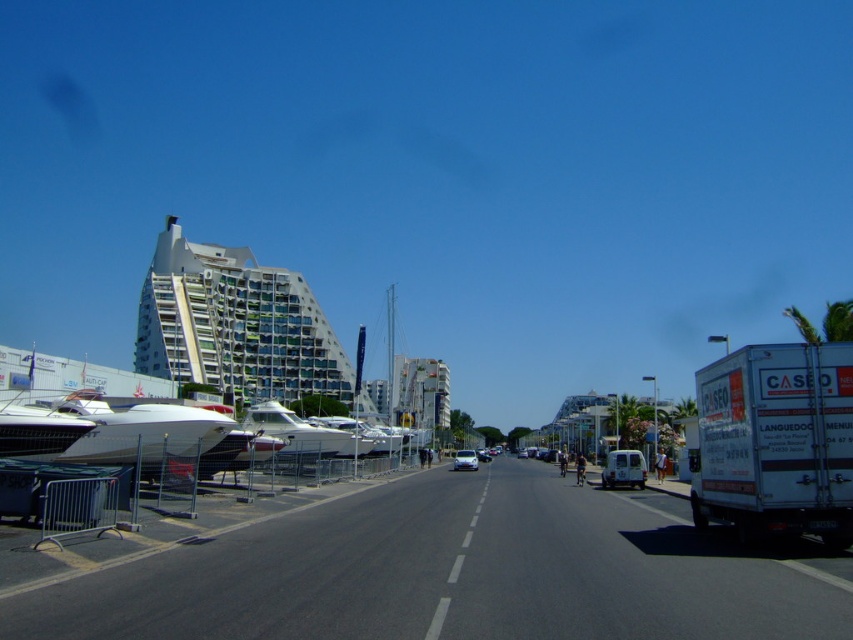
You are a delivery driver who needs to park your truck in the marina area. The marina has a restricted access marked by metal barricades. You see the white glossy boat at center and the silver metallic car at center. Which vehicle has enough space to park next to without overlapping?

The white glossy boat at center is larger in size than the silver metallic car at center, so the silver metallic car at center would require less space to park next to, making it the better option for fitting within the restricted marina area.

You are driving a delivery truck and need to pass through a narrow tunnel that only allows vehicles up to 3 meters in width. You see the white glossy yacht at center and the white glossy car at center in the image. Which vehicle should you avoid taking through the tunnel to ensure safe passage?

The white glossy yacht at center might be wider than the white glossy car at center, so it should be avoided to ensure the vehicle stays within the tunnel width limit.

You are a delivery driver who needs to park your white matte van at center in the marina area. However, there is a white glossy boat at left blocking the entrance. Can you drive around the boat to access the marina?

The white glossy boat at left is in front of the white matte van at center, so the boat is blocking the entrance. To access the marina, you would need to maneuver around the boat. Since the road is on the right side of the marina, you could drive around the boat by going around the left side of it towards the marina entrance.